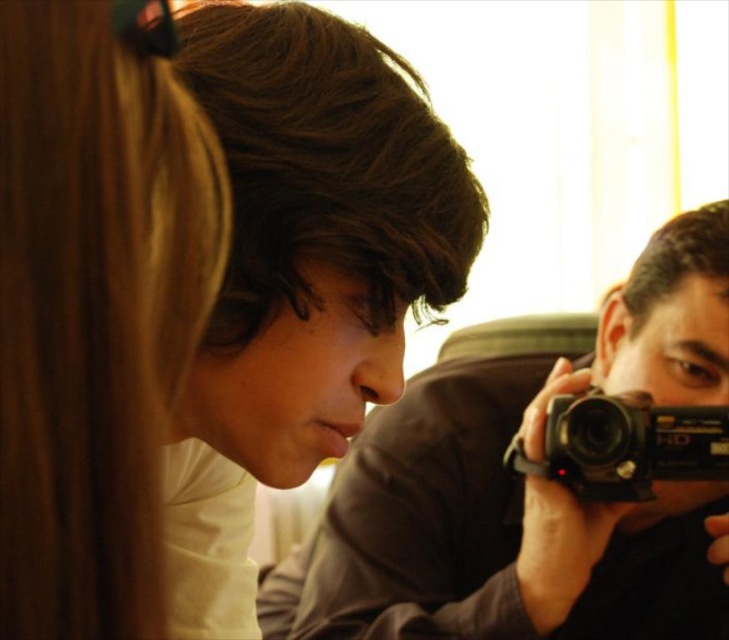
Question: Which of the following is the closest to the observer?

Choices:
 (A) (495, 529)
 (B) (58, 380)
 (C) (211, 36)
 (D) (650, 492)

Answer: (B)

Question: Can you confirm if smooth brown hair at center is wider than black plastic camera at right?

Choices:
 (A) no
 (B) yes

Answer: (B)

Question: Which of the following is the closest to the observer?

Choices:
 (A) (195, 522)
 (B) (655, 454)
 (C) (440, 589)

Answer: (A)

Question: Is the position of smooth blonde hair at upper left less distant than that of black plastic camera at right?

Choices:
 (A) no
 (B) yes

Answer: (B)

Question: Based on their relative distances, which object is nearer to the smooth blonde hair at upper left?

Choices:
 (A) smooth brown hair at center
 (B) black plastic camera at right

Answer: (A)

Question: Does smooth brown hair at center have a smaller size compared to black plastic camera at right?

Choices:
 (A) yes
 (B) no

Answer: (B)